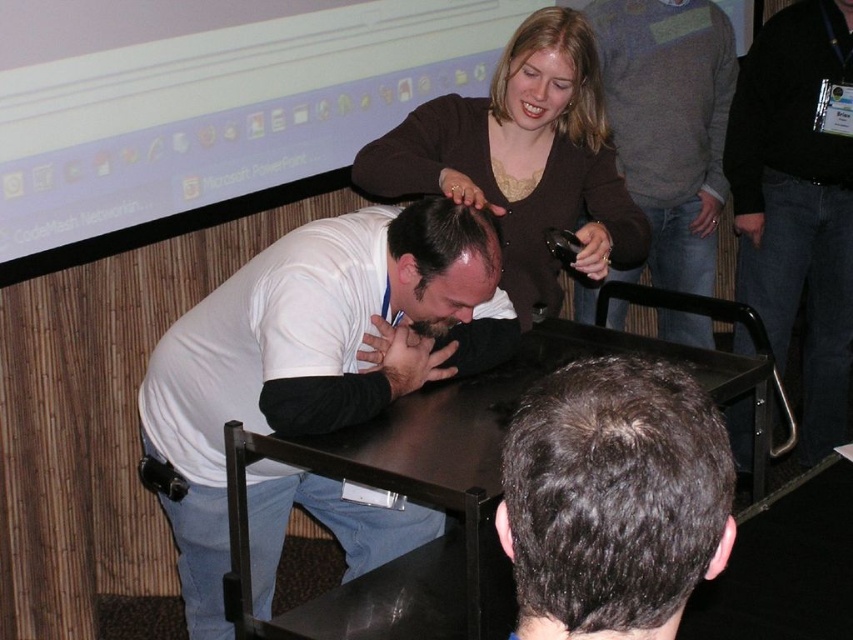
Question: Which of the following is the closest to the observer?

Choices:
 (A) (219, 84)
 (B) (387, 611)

Answer: (B)

Question: Does dark brown hair at center have a lesser width compared to black glossy table at center?

Choices:
 (A) yes
 (B) no

Answer: (A)

Question: Which object is positioned closest to the brown sweater at upper center?

Choices:
 (A) dark brown hair at center
 (B) black sweater at right
 (C) gray sweater at upper center
 (D) matte plastic projector screen at upper center

Answer: (D)

Question: Which of these objects is positioned closest to the brown sweater at upper center?

Choices:
 (A) black glossy table at center
 (B) white matte shirt at center

Answer: (B)

Question: Is black glossy table at center smaller than gray sweater at upper center?

Choices:
 (A) yes
 (B) no

Answer: (B)

Question: In this image, where is black glossy table at center located relative to brown sweater at upper center?

Choices:
 (A) above
 (B) below

Answer: (B)